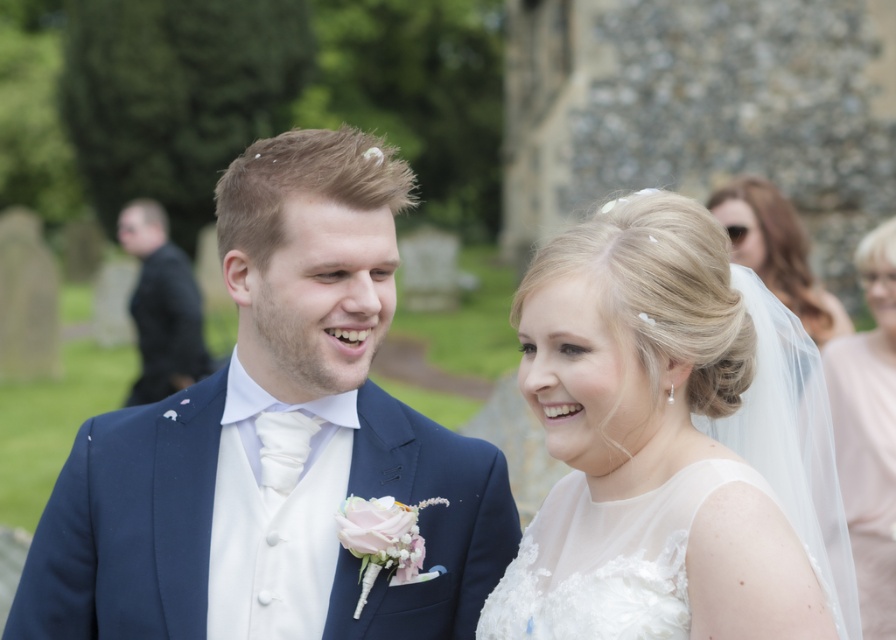
Question: Among these objects, which one is nearest to the camera?

Choices:
 (A) translucent white veil at right
 (B) navy blue suit at center

Answer: (B)

Question: Is navy blue suit at center further to camera compared to translucent white veil at right?

Choices:
 (A) yes
 (B) no

Answer: (B)

Question: Which of the following is the closest to the observer?

Choices:
 (A) translucent white veil at right
 (B) white lace dress at center

Answer: (B)

Question: Which point is farther to the camera?

Choices:
 (A) (616, 556)
 (B) (140, 291)

Answer: (B)

Question: Is navy blue suit at center thinner than white lace dress at center?

Choices:
 (A) yes
 (B) no

Answer: (B)

Question: Is white lace dress at center to the right of translucent white veil at upper right from the viewer's perspective?

Choices:
 (A) no
 (B) yes

Answer: (A)